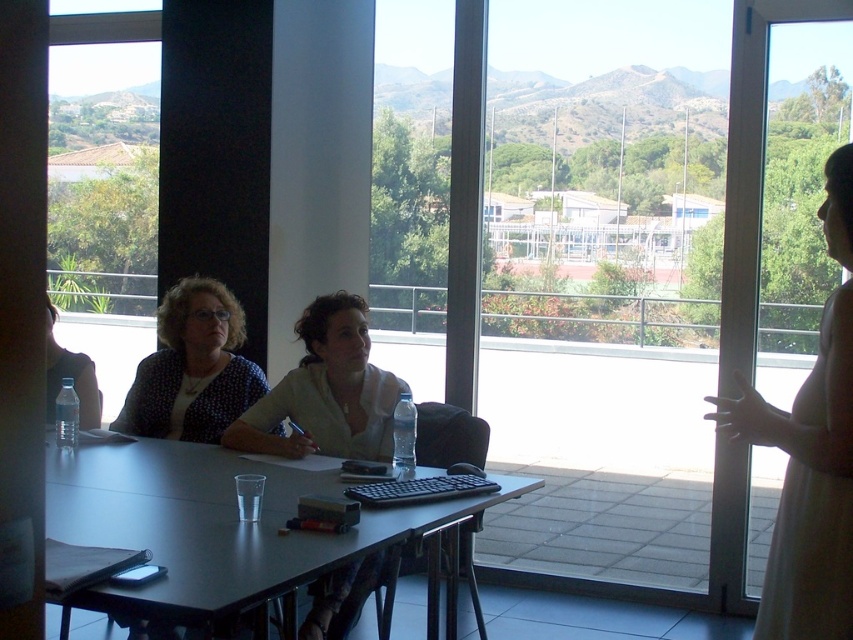
Which is behind, point (821, 448) or point (219, 314)?

The point (219, 314) is more distant.

Can you confirm if white fabric dress at right is wider than matte black blouse at left?

No, white fabric dress at right is not wider than matte black blouse at left.

In the scene shown: Who is more forward, (706, 412) or (219, 358)?

Point (219, 358)

At what (x,y) coordinates should I click in order to perform the action: click on white fabric dress at right. Please return your answer as a coordinate pair (x, y). The width and height of the screenshot is (853, 640). Looking at the image, I should click on (810, 452).

Does matte plastic table at center lie behind white fabric dress at right?

Yes, matte plastic table at center is behind white fabric dress at right.

Does matte plastic table at center have a lesser height compared to white fabric dress at right?

Correct, matte plastic table at center is not as tall as white fabric dress at right.

Describe the element at coordinates (216, 525) in the screenshot. I see `matte plastic table at center` at that location.

Image resolution: width=853 pixels, height=640 pixels. I want to click on matte plastic table at center, so click(x=216, y=525).

Which is above, white matte shirt at center or matte black shirt at left?

matte black shirt at left is higher up.

Is white matte shirt at center closer to the viewer compared to matte black shirt at left?

Yes.

Does point (335, 609) come farther from viewer compared to point (91, 417)?

No, (335, 609) is in front of (91, 417).

Find the location of a particular element. The image size is (853, 640). white matte shirt at center is located at coordinates (326, 392).